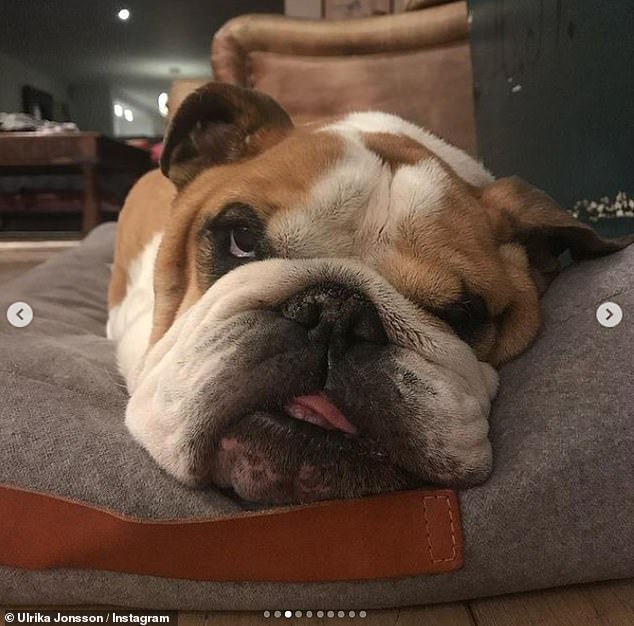
Where is `handle`? The image size is (634, 626). handle is located at coordinates (230, 536).